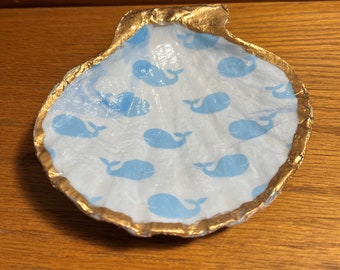
Where is `wooden surface`? The image size is (340, 270). wooden surface is located at coordinates (29, 37), (306, 45).